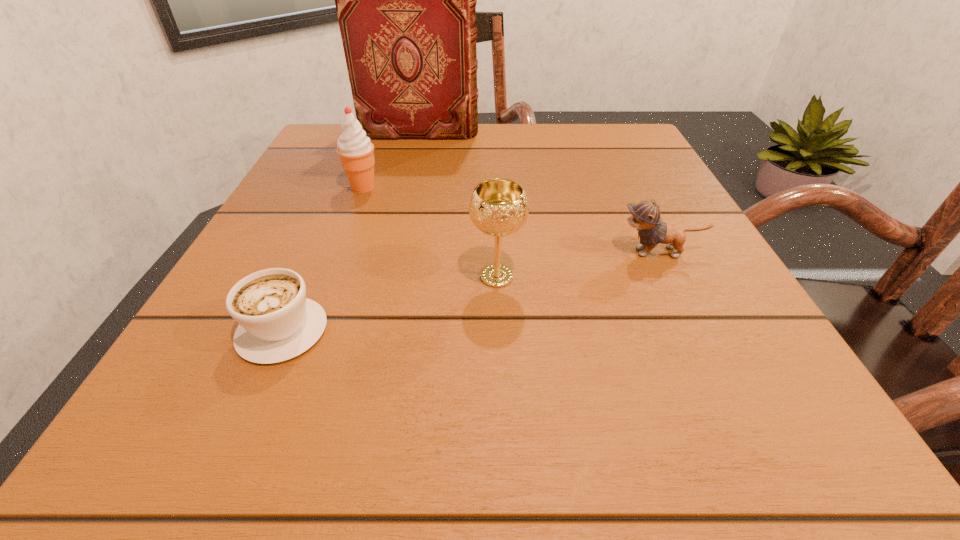
Identify the location of vacant space situated 0.150m on the back of the chalice. This screenshot has height=540, width=960. (493, 207).

Find the location of a particular element. The image size is (960, 540). free spot located on the front-facing side of the fourth tallest object is located at coordinates (429, 252).

This screenshot has width=960, height=540. In order to click on free space located on the front-facing side of the fourth tallest object in this screenshot , I will do `click(392, 252)`.

This screenshot has height=540, width=960. In order to click on vacant area situated 0.150m on the front-facing side of the fourth tallest object in this screenshot , I will do `click(523, 252)`.

Where is `free space located 0.200m to the right of the shortest object's handle`? This screenshot has width=960, height=540. free space located 0.200m to the right of the shortest object's handle is located at coordinates (332, 218).

Where is `free space located 0.130m to the right of the shortest object's handle`? free space located 0.130m to the right of the shortest object's handle is located at coordinates (322, 242).

Identify the location of vacant region located 0.230m to the right of the shortest object's handle. This screenshot has width=960, height=540. (336, 208).

Locate an element on the screen. object located at the far edge is located at coordinates click(406, 0).

At what (x,y) coordinates should I click in order to perform the action: click on hardback book that is at the left edge. Please return your answer as a coordinate pair (x, y). This screenshot has height=540, width=960. Looking at the image, I should click on (406, 0).

Where is `icecream present at the left edge`? icecream present at the left edge is located at coordinates (355, 149).